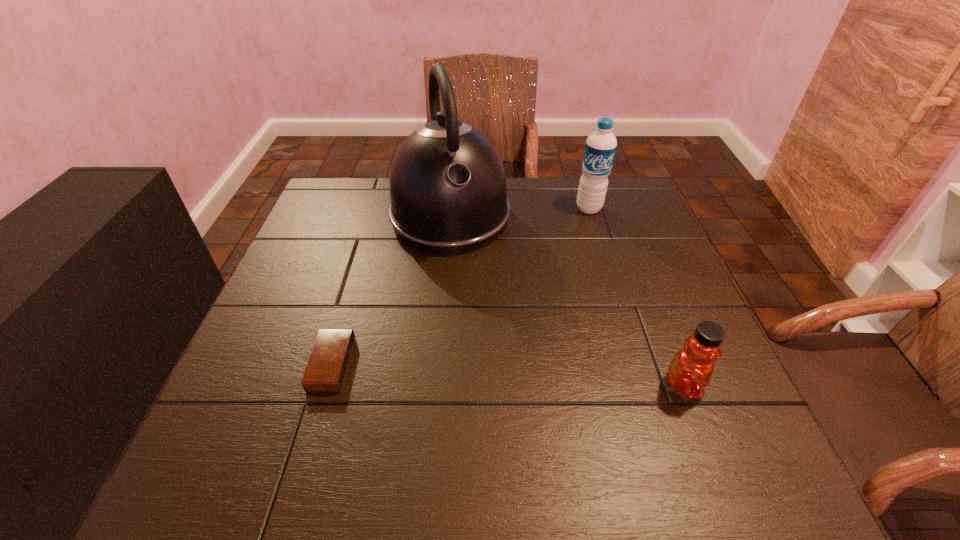
Where is `vacant space situated 0.080m on the spout of the kettle`? vacant space situated 0.080m on the spout of the kettle is located at coordinates (469, 281).

The width and height of the screenshot is (960, 540). In order to click on free point located 0.170m on the spout of the kettle in this screenshot , I will do `click(478, 308)`.

Locate an element on the screen. This screenshot has width=960, height=540. free region located 0.150m on the label of the third object from left to right is located at coordinates (574, 247).

Find the location of a particular element. free space located 0.350m on the label of the third object from left to right is located at coordinates (554, 299).

Locate an element on the screen. Image resolution: width=960 pixels, height=540 pixels. vacant space situated 0.400m on the label of the third object from left to right is located at coordinates (548, 314).

Image resolution: width=960 pixels, height=540 pixels. I want to click on kettle at the far edge, so click(x=448, y=194).

I want to click on water bottle present at the far edge, so [600, 148].

At what (x,y) coordinates should I click in order to perform the action: click on alarm clock that is at the near edge. Please return your answer as a coordinate pair (x, y). Image resolution: width=960 pixels, height=540 pixels. Looking at the image, I should click on (328, 363).

Identify the location of honey present at the near edge. (690, 371).

The image size is (960, 540). Identify the location of object present at the left edge. (328, 363).